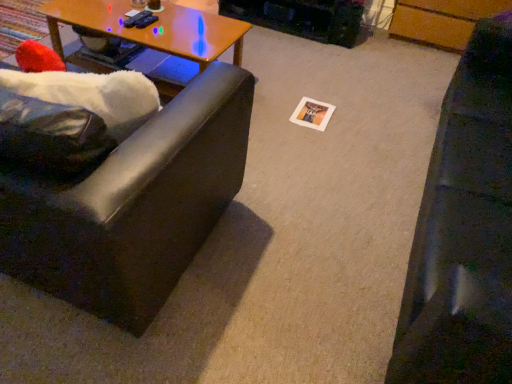
Question: Considering the positions of wooden at left and black leather couch at right, which is counted as the 1th studio couch, starting from the right, in the image, is wooden at left taller or shorter than black leather couch at right, which is counted as the 1th studio couch, starting from the right,?

Choices:
 (A) short
 (B) tall

Answer: (A)

Question: Is point (114, 6) positioned closer to the camera than point (465, 193)?

Choices:
 (A) closer
 (B) farther

Answer: (B)

Question: Based on their relative distances, which object is nearer to the matte black couch at left, which is counted as the 2th studio couch, starting from the right?

Choices:
 (A) black leather couch at right, the second studio couch positioned from the left
 (B) wooden at left
 (C) matte brown coffee cup at upper center

Answer: (A)

Question: Estimate the real-world distances between objects in this image. Which object is farther from the wooden at left?

Choices:
 (A) black leather couch at right, which is counted as the 1th studio couch, starting from the right
 (B) matte brown coffee cup at upper center
 (C) matte black couch at left, which is counted as the first studio couch, starting from the left

Answer: (A)